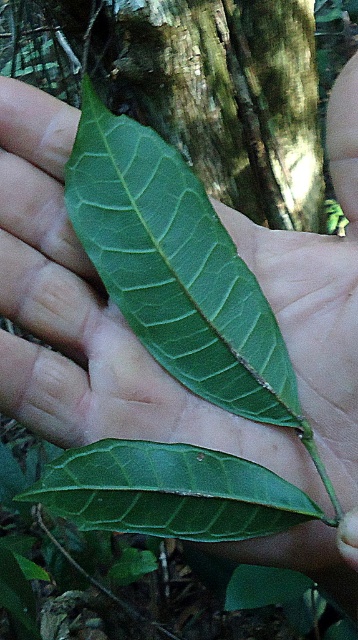
You are a botanist examining two leaves in your hand. You have a green matte leaf at center and a green glossy leaf at center. Which leaf is covering the other one?

The green matte leaf at center is positioned over the green glossy leaf at center, so it is covering the other leaf.